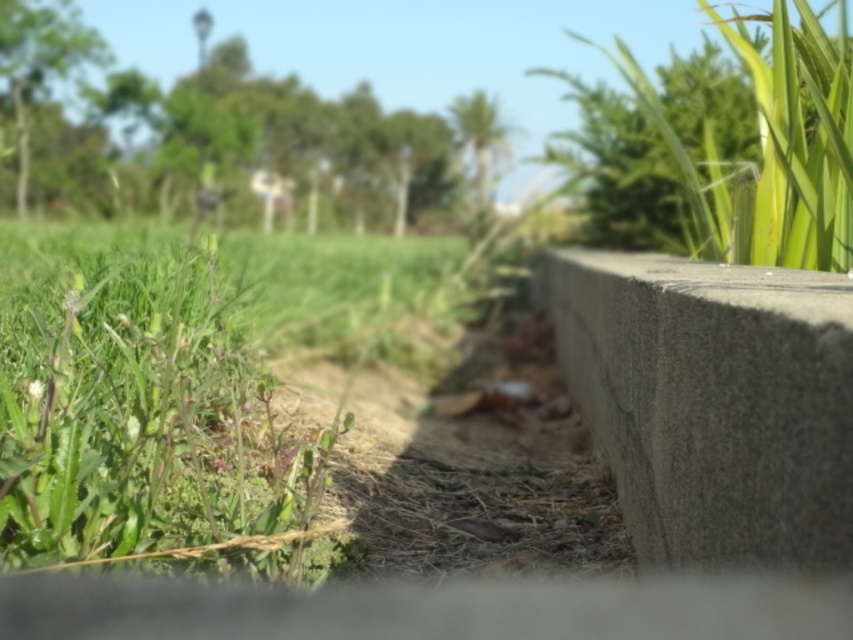
Question: Does green grass at left have a smaller size compared to gray concrete at right?

Choices:
 (A) yes
 (B) no

Answer: (B)

Question: Can you confirm if green grass at left is smaller than gray concrete at right?

Choices:
 (A) no
 (B) yes

Answer: (A)

Question: Does green grass at left come behind gray concrete at right?

Choices:
 (A) no
 (B) yes

Answer: (A)

Question: Which point appears closest to the camera in this image?

Choices:
 (A) (740, 554)
 (B) (42, 390)

Answer: (A)

Question: Which point is farther to the camera?

Choices:
 (A) (22, 250)
 (B) (730, 484)

Answer: (A)

Question: Which of the following is the closest to the observer?

Choices:
 (A) green grass at left
 (B) gray concrete at right

Answer: (A)